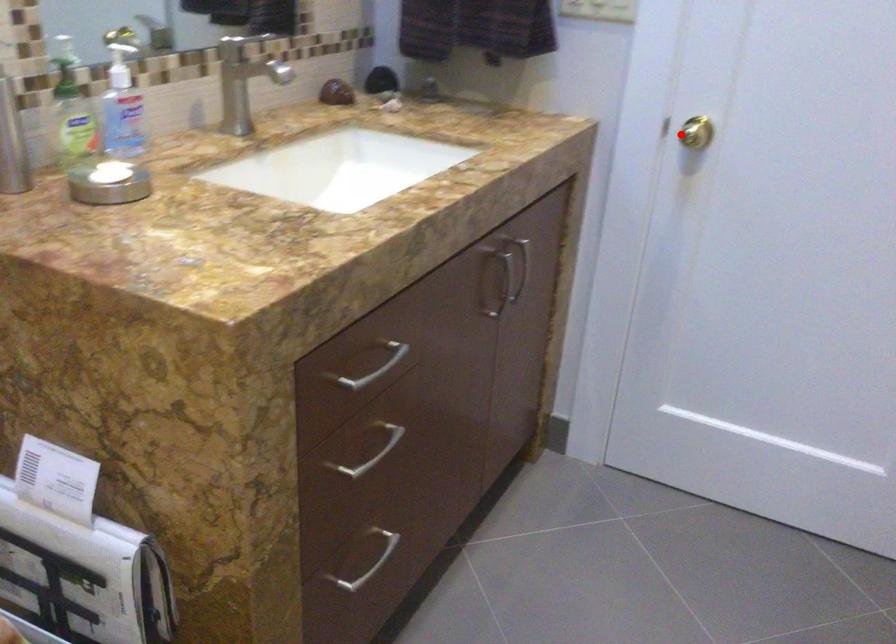
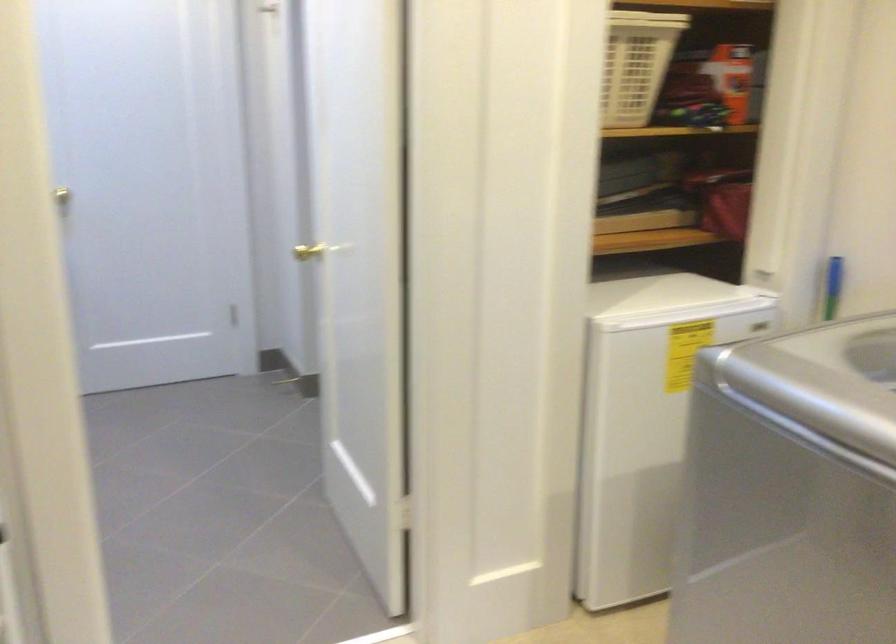
Question: I am providing you with two images of the same scene from different viewpoints. In image1, a red point is highlighted. Considering the same 3D point in image2, which of the following is correct?

Choices:
 (A) It is closer
 (B) It is farther

Answer: (B)